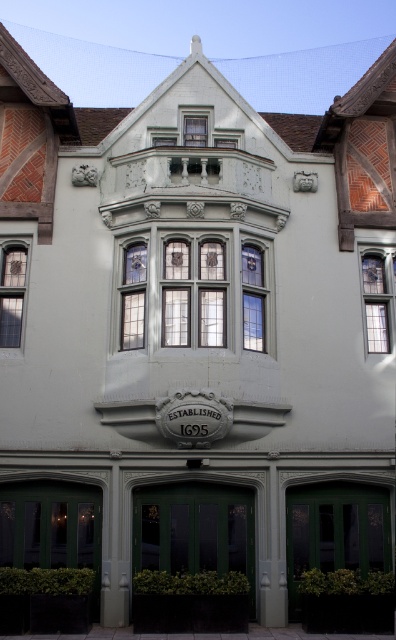
Question: Estimate the real-world distances between objects in this image. Which object is closer to the clear glass window at center right?

Choices:
 (A) clear glass window at left
 (B) clear glass windows at center
 (C) clear glass window at upper center

Answer: (B)

Question: Among these objects, which one is farthest from the camera?

Choices:
 (A) clear glass window at left
 (B) clear glass window at center right
 (C) clear glass windows at center

Answer: (B)

Question: Does clear glass window at center right lie in front of clear glass window at left?

Choices:
 (A) no
 (B) yes

Answer: (A)

Question: Is clear glass window at center right smaller than clear glass window at left?

Choices:
 (A) yes
 (B) no

Answer: (A)

Question: Which point is farther from the camera taking this photo?

Choices:
 (A) (22, 288)
 (B) (190, 116)
 (C) (386, 264)

Answer: (B)

Question: Does clear glass windows at center have a lesser width compared to clear glass window at left?

Choices:
 (A) no
 (B) yes

Answer: (A)